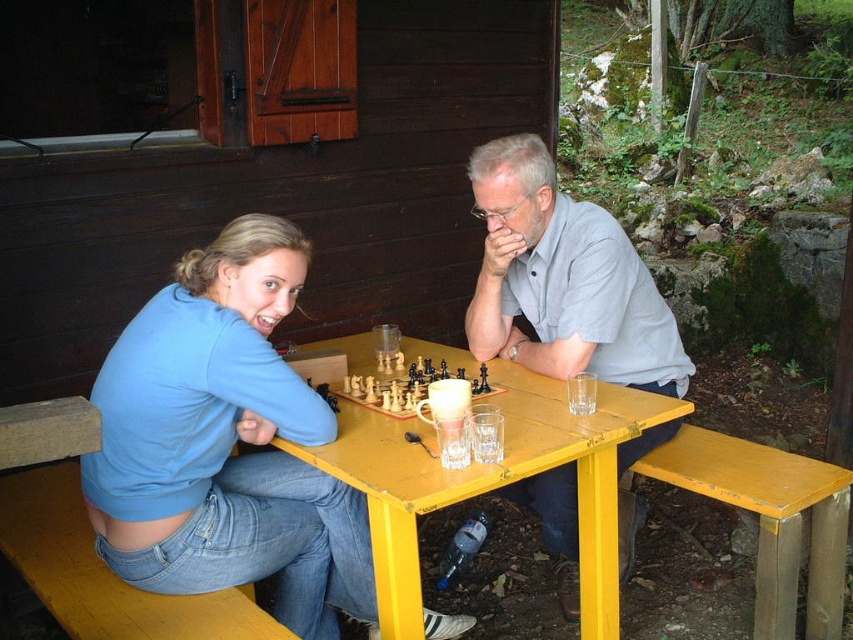
Does blue cotton shirt at left come in front of gray cotton shirt at center?

That is True.

Between blue cotton shirt at left and gray cotton shirt at center, which one is positioned lower?

Positioned lower is blue cotton shirt at left.

Locate an element on the screen. Image resolution: width=853 pixels, height=640 pixels. blue cotton shirt at left is located at coordinates (224, 442).

Who is positioned more to the right, blue cotton shirt at left or yellow wood table at center?

From the viewer's perspective, yellow wood table at center appears more on the right side.

Locate an element on the screen. The width and height of the screenshot is (853, 640). blue cotton shirt at left is located at coordinates (224, 442).

Which is in front, point (239, 465) or point (582, 474)?

Point (582, 474) is more forward.

This screenshot has width=853, height=640. Find the location of `blue cotton shirt at left`. blue cotton shirt at left is located at coordinates (224, 442).

Is point (248, 563) more distant than point (401, 397)?

No, (248, 563) is in front of (401, 397).

Is point (309, 632) farther from camera compared to point (434, 381)?

Yes, it is behind point (434, 381).

At what (x,y) coordinates should I click in order to perform the action: click on blue cotton shirt at left. Please return your answer as a coordinate pair (x, y). Image resolution: width=853 pixels, height=640 pixels. Looking at the image, I should click on (224, 442).